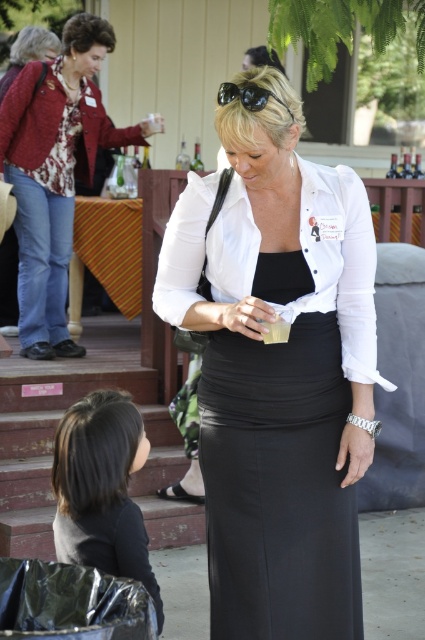
You are a photographer at the event and need to ensure both the white matte shirt at center and the black fabric hair at lower left are visible in your photo. Given their sizes, which object might require you to adjust your camera angle to include it properly?

The black fabric hair at lower left is larger than the white matte shirt at center, so you may need to adjust your camera angle to ensure it is fully visible in the photo.

You are a photographer at the wine tasting event. You want to capture a photo that includes both the white matte shirt at center and the black fabric hair at lower left. The minimum distance your camera can focus on two objects is 35 inches. Will you be able to capture both in focus?

The white matte shirt at center is 37.47 inches from the black fabric hair at lower left. Since the minimum focus distance is 35 inches, the 37.47 inches is beyond the minimum requirement, so yes, the camera can focus on both objects.